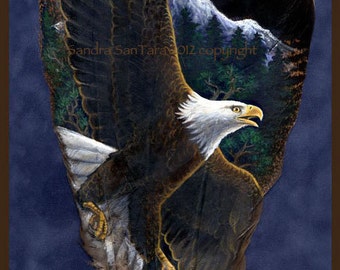
Identify the location of brown line on the right of artwork. (335, 178).